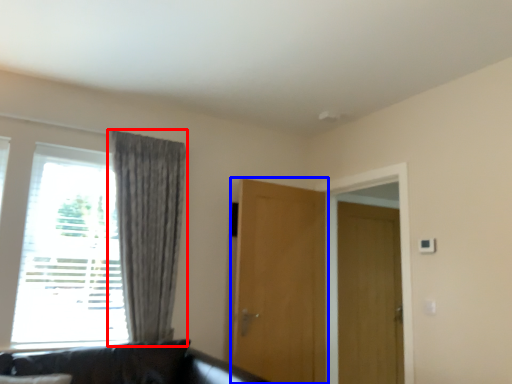
Question: Which point is further to the camera, curtain (highlighted by a red box) or door (highlighted by a blue box)?

Choices:
 (A) curtain
 (B) door

Answer: (B)